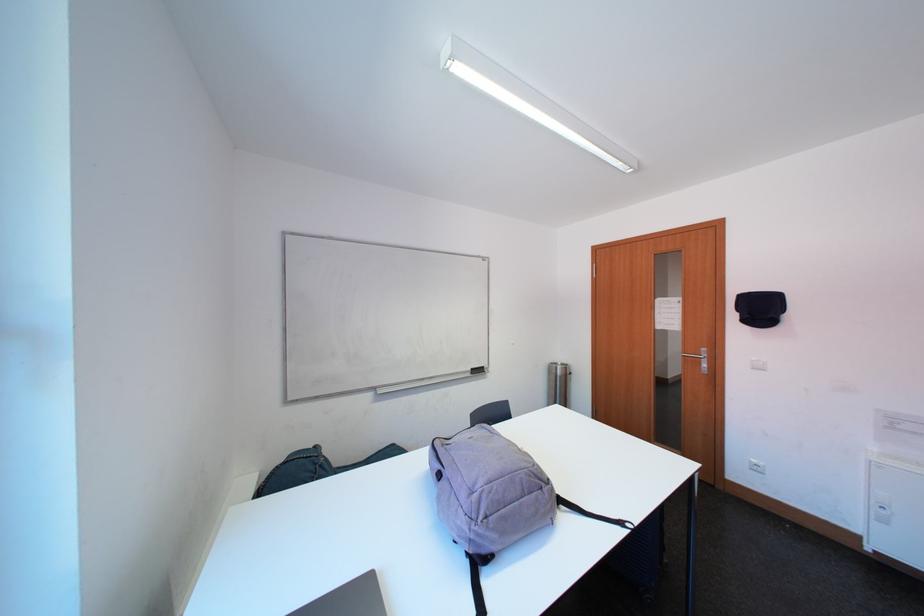
Identify the location of metal door handle. (699, 359).